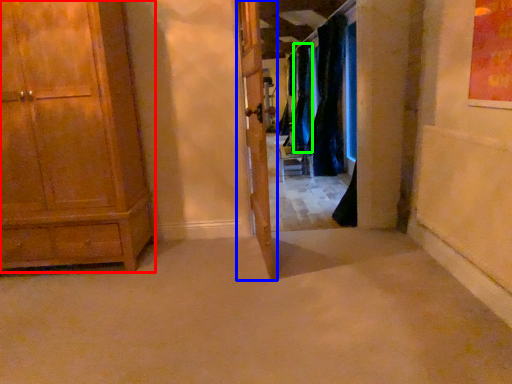
Question: Estimate the real-world distances between objects in this image. Which object is closer to cabinetry (highlighted by a red box), door (highlighted by a blue box) or curtain (highlighted by a green box)?

Choices:
 (A) door
 (B) curtain

Answer: (A)